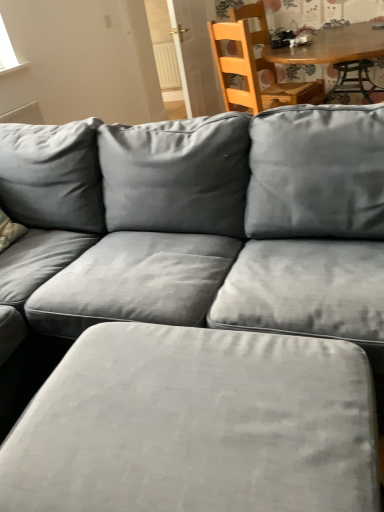
Question: Does suede gray ottoman at lower center have a smaller size compared to wooden chair at upper right?

Choices:
 (A) yes
 (B) no

Answer: (B)

Question: Is suede gray ottoman at lower center surrounding wooden chair at upper right?

Choices:
 (A) no
 (B) yes

Answer: (A)

Question: From the image's perspective, is suede gray ottoman at lower center beneath wooden chair at upper right?

Choices:
 (A) yes
 (B) no

Answer: (A)

Question: Are suede gray ottoman at lower center and wooden chair at upper right making contact?

Choices:
 (A) no
 (B) yes

Answer: (A)

Question: Is suede gray ottoman at lower center facing towards wooden chair at upper right?

Choices:
 (A) no
 (B) yes

Answer: (A)

Question: Can you confirm if suede gray ottoman at lower center is positioned to the left of wooden chair at upper right?

Choices:
 (A) yes
 (B) no

Answer: (A)

Question: From a real-world perspective, does wooden chair at upper right stand above white plastic radiator at upper center?

Choices:
 (A) yes
 (B) no

Answer: (A)

Question: Can you confirm if wooden chair at upper right is bigger than white plastic radiator at upper center?

Choices:
 (A) yes
 (B) no

Answer: (A)

Question: Is wooden chair at upper right with white plastic radiator at upper center?

Choices:
 (A) yes
 (B) no

Answer: (B)

Question: Can you confirm if wooden chair at upper right is positioned to the right of white plastic radiator at upper center?

Choices:
 (A) no
 (B) yes

Answer: (B)

Question: From the image's perspective, does wooden chair at upper right appear lower than white plastic radiator at upper center?

Choices:
 (A) no
 (B) yes

Answer: (B)

Question: Is the depth of wooden chair at upper right less than that of white plastic radiator at upper center?

Choices:
 (A) yes
 (B) no

Answer: (A)

Question: Is the depth of suede gray ottoman at lower center less than that of white plastic radiator at upper center?

Choices:
 (A) no
 (B) yes

Answer: (B)